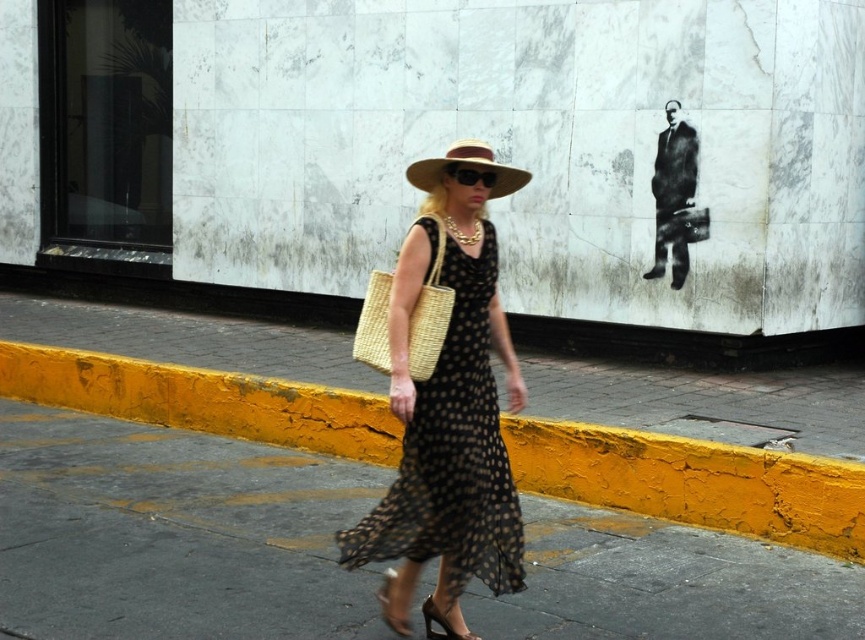
You are a fashion designer observing the woman in the scene. You need to determine the placement of the dress and sandal in the image. Is the black dotted fabric dress at center covering part of the shiny gold sandal at lower center?

The black dotted fabric dress at center is positioned over shiny gold sandal at lower center, so yes, the dress is covering part of the sandal.

You are a delivery person who needs to place a small package between the woven straw bag at center and the shiny brown leather sandal at lower center. Can you fit the package in the space between them?

The distance between the woven straw bag at center and the shiny brown leather sandal at lower center is 37.93 inches. Since the package is small, it should easily fit in the space between them.

You are a fashion designer analyzing the image. You need to determine if the black dotted fabric dress at center can be worn with the shiny gold sandal at lower center based on their sizes. Can the dress accommodate the sandal?

The black dotted fabric dress at center is wider than the shiny gold sandal at lower center, so yes, the dress can accommodate the sandal as its width allows for the sandal to be worn comfortably.